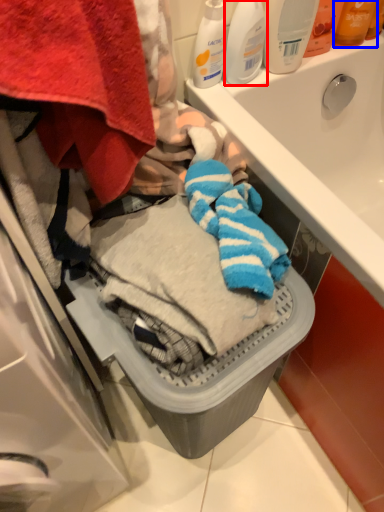
Question: Which object appears closest to the camera in this image, cleaning product (highlighted by a red box) or toiletry (highlighted by a blue box)?

Choices:
 (A) cleaning product
 (B) toiletry

Answer: (A)